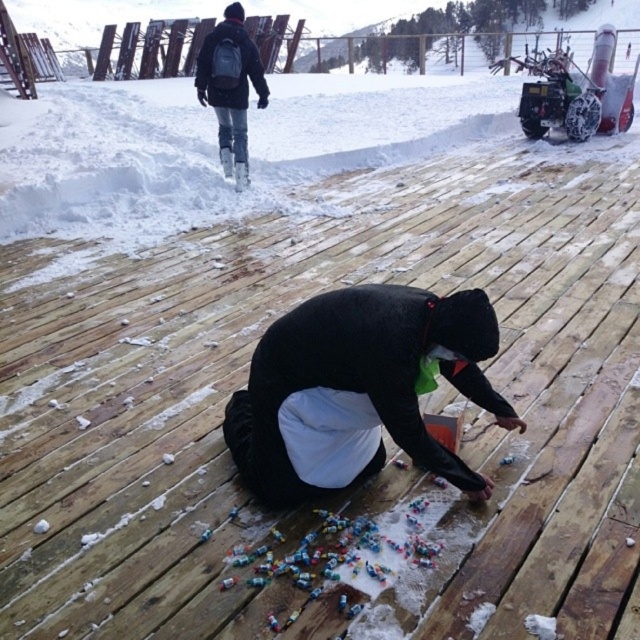
You are a photographer trying to capture both the black matte jacket at center and the black backpack at upper left in a single shot. Which object should you focus on first to ensure both are in focus?

You should focus on the black matte jacket at center first because it is closer to the viewer than the black backpack at upper left, ensuring that both will be in focus when using a camera with depth of field considerations.

You are a hiker who needs to locate your jacket and backpack in the snowy scene. According to the image, where is the black matte jacket at center in relation to the black backpack at upper left?

The black matte jacket at center is to the right of the black backpack at upper left.